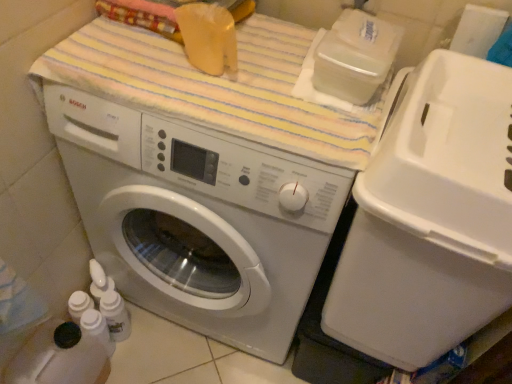
Where is `vacant region above white glossy washing machine at center (from a real-world perspective)`? This screenshot has width=512, height=384. vacant region above white glossy washing machine at center (from a real-world perspective) is located at coordinates (231, 79).